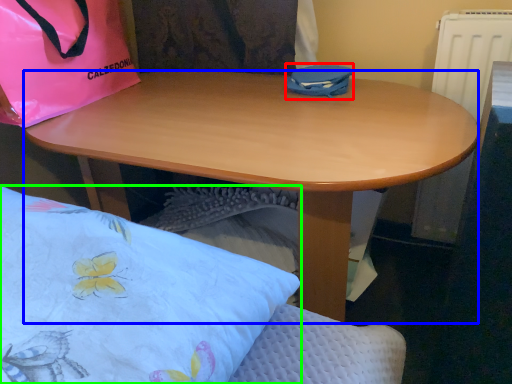
Question: Estimate the real-world distances between objects in this image. Which object is farther from bag (highlighted by a red box), desk (highlighted by a blue box) or pillow (highlighted by a green box)?

Choices:
 (A) desk
 (B) pillow

Answer: (B)